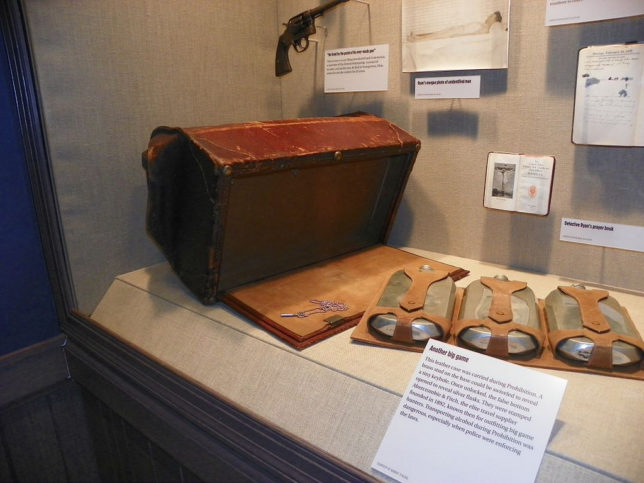
This screenshot has height=483, width=644. What are the coordinates of `wall` in the screenshot? It's located at (26, 284).